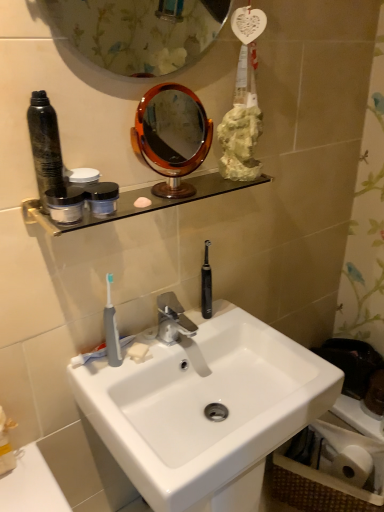
Find the location of a particular element. The height and width of the screenshot is (512, 384). free space between black rubber toothbrush at center, acting as the first toothbrush starting from the back, and silver metallic faucet at center is located at coordinates (205, 327).